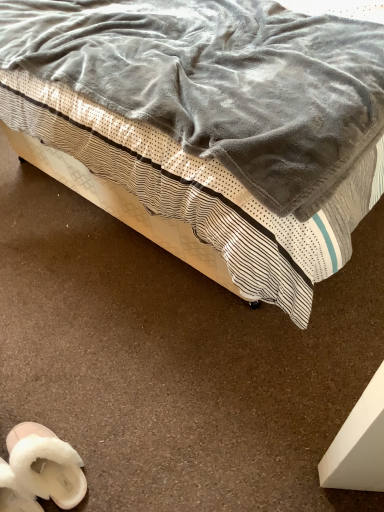
Question: Could you tell me if white fluffy slippers at lower left, marked as the second footwear in a left-to-right arrangement, is facing white fluffy slippers at lower left, arranged as the 1th footwear when viewed from the left?

Choices:
 (A) no
 (B) yes

Answer: (A)

Question: Considering the relative sizes of white fluffy slippers at lower left, marked as the second footwear in a left-to-right arrangement, and white fluffy slippers at lower left, positioned as the second footwear in right-to-left order, in the image provided, is white fluffy slippers at lower left, marked as the second footwear in a left-to-right arrangement, shorter than white fluffy slippers at lower left, positioned as the second footwear in right-to-left order,?

Choices:
 (A) no
 (B) yes

Answer: (A)

Question: Is white fluffy slippers at lower left, marked as the second footwear in a left-to-right arrangement, closer to the viewer compared to white fluffy slippers at lower left, arranged as the 1th footwear when viewed from the left?

Choices:
 (A) no
 (B) yes

Answer: (A)

Question: Does white fluffy slippers at lower left, marked as the first footwear in a right-to-left arrangement, have a larger size compared to white fluffy slippers at lower left, arranged as the 1th footwear when viewed from the left?

Choices:
 (A) yes
 (B) no

Answer: (A)

Question: Can white fluffy slippers at lower left, arranged as the 1th footwear when viewed from the left, be found inside white fluffy slippers at lower left, marked as the first footwear in a right-to-left arrangement?

Choices:
 (A) no
 (B) yes

Answer: (A)

Question: Looking at the image, does white fluffy slippers at lower left, marked as the second footwear in a left-to-right arrangement, seem bigger or smaller compared to white fluffy slippers at lower left, positioned as the second footwear in right-to-left order?

Choices:
 (A) big
 (B) small

Answer: (A)

Question: Is white fluffy slippers at lower left, marked as the second footwear in a left-to-right arrangement, wider or thinner than white fluffy slippers at lower left, arranged as the 1th footwear when viewed from the left?

Choices:
 (A) wide
 (B) thin

Answer: (A)

Question: From a real-world perspective, is white fluffy slippers at lower left, marked as the second footwear in a left-to-right arrangement, positioned above or below white fluffy slippers at lower left, positioned as the second footwear in right-to-left order?

Choices:
 (A) above
 (B) below

Answer: (A)

Question: Relative to white fluffy slippers at lower left, arranged as the 1th footwear when viewed from the left, is white fluffy slippers at lower left, marked as the first footwear in a right-to-left arrangement, in front or behind?

Choices:
 (A) behind
 (B) front

Answer: (A)

Question: Relative to white fluffy slippers at lower left, positioned as the second footwear in right-to-left order, is velvet gray blanket at upper center in front or behind?

Choices:
 (A) behind
 (B) front

Answer: (B)

Question: From the image's perspective, is velvet gray blanket at upper center above or below white fluffy slippers at lower left, arranged as the 1th footwear when viewed from the left?

Choices:
 (A) below
 (B) above

Answer: (B)

Question: In terms of height, does velvet gray blanket at upper center look taller or shorter compared to white fluffy slippers at lower left, arranged as the 1th footwear when viewed from the left?

Choices:
 (A) tall
 (B) short

Answer: (A)

Question: Does point (13, 71) appear closer or farther from the camera than point (6, 468)?

Choices:
 (A) farther
 (B) closer

Answer: (A)

Question: In terms of height, does velvet gray blanket at upper center look taller or shorter compared to white fluffy slippers at lower left, marked as the second footwear in a left-to-right arrangement?

Choices:
 (A) short
 (B) tall

Answer: (B)

Question: Does point (92, 26) appear closer or farther from the camera than point (3, 501)?

Choices:
 (A) farther
 (B) closer

Answer: (A)